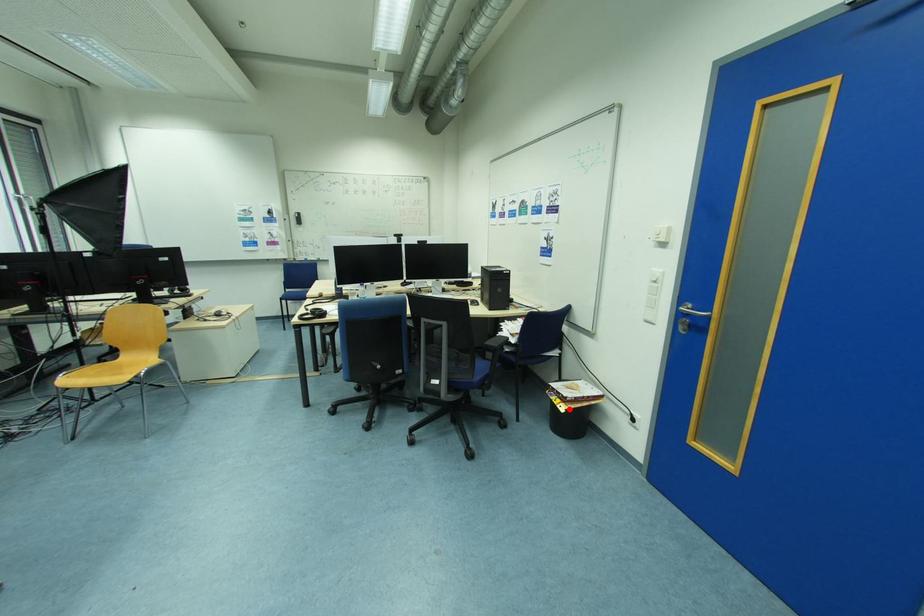
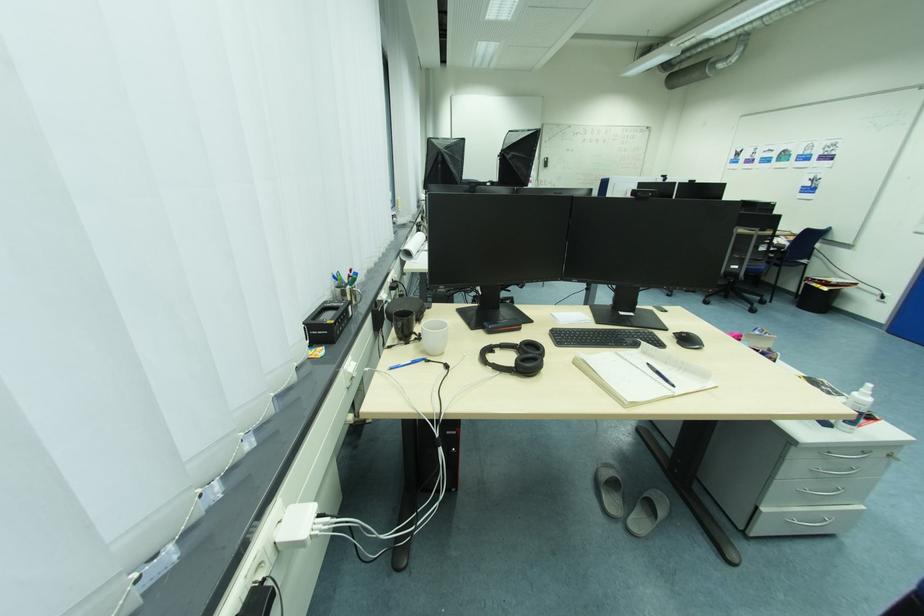
Where in the second image is the point corresponding to the highlighted location from the first image?

(833, 290)